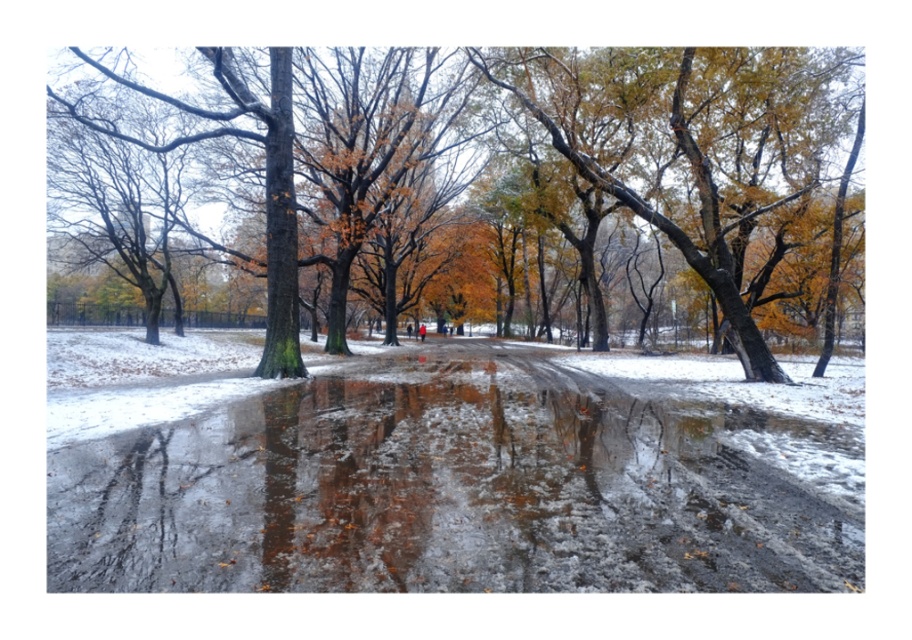
Question: Which object is positioned closest to the green matte tree at center?

Choices:
 (A) yellow-green bark tree at upper right
 (B) slick asphalt puddle at center

Answer: (A)

Question: Is the position of slick asphalt puddle at center more distant than that of yellow-green bark tree at upper right?

Choices:
 (A) no
 (B) yes

Answer: (A)

Question: Does slick asphalt puddle at center have a lesser width compared to yellow-green bark tree at upper right?

Choices:
 (A) yes
 (B) no

Answer: (A)

Question: Which is farther from the yellow-green bark tree at upper right?

Choices:
 (A) slick asphalt puddle at center
 (B) green matte tree at center

Answer: (A)

Question: Estimate the real-world distances between objects in this image. Which object is farther from the green matte tree at center?

Choices:
 (A) slick asphalt puddle at center
 (B) yellow-green bark tree at upper right

Answer: (A)

Question: Is green matte tree at center positioned in front of yellow-green bark tree at upper right?

Choices:
 (A) no
 (B) yes

Answer: (B)